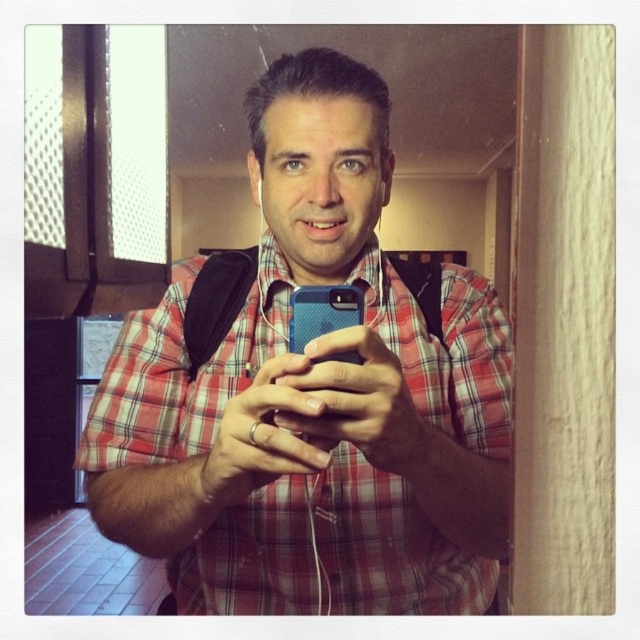
Is point (193, 381) farther from camera compared to point (342, 362)?

Yes, it is.

Is blue matte phone at center to the right of blue textured phone at center from the viewer's perspective?

In fact, blue matte phone at center is to the left of blue textured phone at center.

Describe the element at coordinates (312, 397) in the screenshot. I see `blue matte phone at center` at that location.

This screenshot has height=640, width=640. Find the location of `blue matte phone at center`. blue matte phone at center is located at coordinates (312, 397).